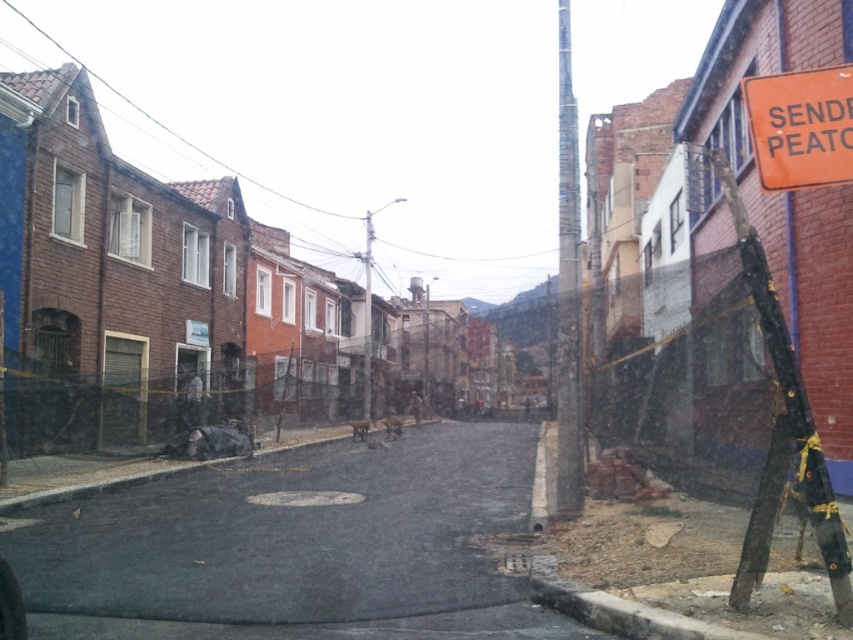
You are driving a car and need to turn left onto the dark asphalt road at center. There is an orange plastic sign at upper right ahead. Will the sign be on your left or right side as you approach the road?

The dark asphalt road at center is to the left of orange plastic sign at upper right, so as you approach the road, the orange plastic sign at upper right will be on your right side.

You are a delivery driver who needs to navigate through the dark asphalt road at center. There is an orange plastic sign at upper right that might obstruct your path. Based on the scene, can you determine if the sign is tall enough to hit your truck?

The dark asphalt road at center is much taller than the orange plastic sign at upper right, so the sign is not tall enough to hit your truck.

From the picture: You are standing on the sidewalk and looking through a foggy window. There is a dark asphalt road at center marked by point (296, 547). Can you confirm if the point is located on the road or on the buildings?

The dark asphalt road at center is represented by point (296, 547), so the point is located on the road.